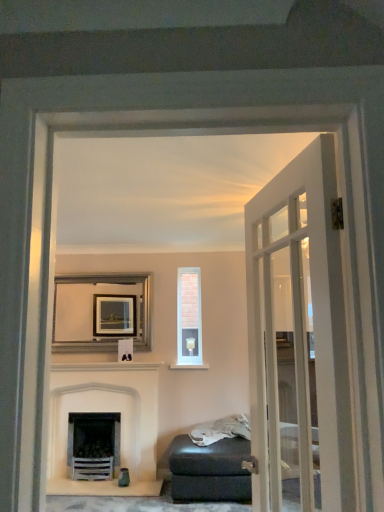
Question: Is silver metallic picture frame at center not close to matte black ottoman at lower center?

Choices:
 (A) yes
 (B) no

Answer: (A)

Question: Considering the relative sizes of silver metallic picture frame at center and matte black ottoman at lower center in the image provided, is silver metallic picture frame at center shorter than matte black ottoman at lower center?

Choices:
 (A) yes
 (B) no

Answer: (B)

Question: Is silver metallic picture frame at center oriented away from matte black ottoman at lower center?

Choices:
 (A) no
 (B) yes

Answer: (A)

Question: Does silver metallic picture frame at center have a greater height compared to matte black ottoman at lower center?

Choices:
 (A) no
 (B) yes

Answer: (B)

Question: Does silver metallic picture frame at center appear on the right side of matte black ottoman at lower center?

Choices:
 (A) yes
 (B) no

Answer: (B)

Question: In terms of height, does white glass door at right look taller or shorter compared to white stone fireplace at lower left?

Choices:
 (A) tall
 (B) short

Answer: (A)

Question: From a real-world perspective, is white glass door at right positioned above or below white stone fireplace at lower left?

Choices:
 (A) below
 (B) above

Answer: (B)

Question: In the image, is white glass door at right on the left side or the right side of white stone fireplace at lower left?

Choices:
 (A) left
 (B) right

Answer: (B)

Question: Looking at their shapes, would you say white glass door at right is wider or thinner than white stone fireplace at lower left?

Choices:
 (A) thin
 (B) wide

Answer: (A)

Question: Considering the positions of point (226, 471) and point (180, 347), is point (226, 471) closer or farther from the camera than point (180, 347)?

Choices:
 (A) farther
 (B) closer

Answer: (B)

Question: Is matte black ottoman at lower center to the left or to the right of white brick wall at center in the image?

Choices:
 (A) right
 (B) left

Answer: (A)

Question: From their relative heights in the image, would you say matte black ottoman at lower center is taller or shorter than white brick wall at center?

Choices:
 (A) tall
 (B) short

Answer: (B)

Question: Considering the positions of matte black ottoman at lower center and white brick wall at center in the image, is matte black ottoman at lower center wider or thinner than white brick wall at center?

Choices:
 (A) thin
 (B) wide

Answer: (B)

Question: Looking at the image, does silver metallic picture frame at center seem bigger or smaller compared to white stone fireplace at lower left?

Choices:
 (A) small
 (B) big

Answer: (A)

Question: Considering the positions of point (69, 322) and point (49, 432), is point (69, 322) closer or farther from the camera than point (49, 432)?

Choices:
 (A) closer
 (B) farther

Answer: (B)